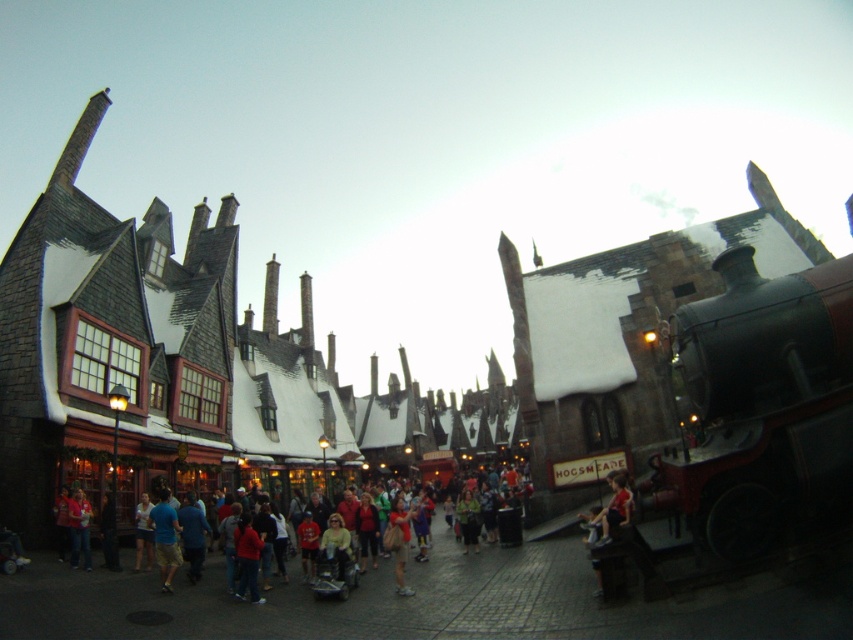
Question: Which object appears farthest from the camera in this image?

Choices:
 (A) matte beige shirt at center
 (B) blue cotton shorts at center

Answer: (A)

Question: Is blue cotton shorts at center thinner than matte beige shirt at center?

Choices:
 (A) yes
 (B) no

Answer: (B)

Question: From the image, what is the correct spatial relationship of blue cotton shorts at center in relation to matte beige shirt at center?

Choices:
 (A) left
 (B) right

Answer: (A)

Question: Is blue cotton shorts at center positioned in front of matte beige shirt at center?

Choices:
 (A) yes
 (B) no

Answer: (A)